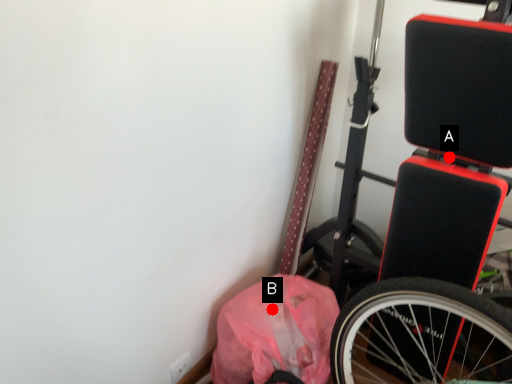
Question: Two points are circled on the image, labeled by A and B beside each circle. Which point is farther to the camera?

Choices:
 (A) A is further
 (B) B is further

Answer: (B)